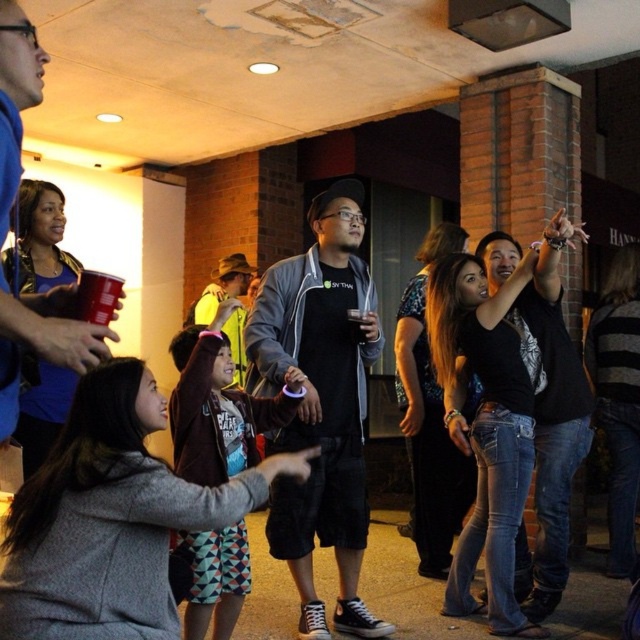
Question: Estimate the real-world distances between objects in this image. Which object is closer to the yellow fabric shirt at center?

Choices:
 (A) matte black t-shirt at center
 (B) multicolored fabric dress at center

Answer: (A)

Question: From the image, what is the correct spatial relationship of matte black t-shirt at center in relation to matte black hoodie at center?

Choices:
 (A) below
 (B) above

Answer: (A)

Question: Which of the following is the closest to the observer?

Choices:
 (A) yellow fabric shirt at center
 (B) matte black hoodie at center
 (C) matte black t-shirt at center
 (D) multicolored fabric dress at center

Answer: (B)

Question: Does matte black t-shirt at center come in front of matte black hoodie at center?

Choices:
 (A) yes
 (B) no

Answer: (B)

Question: Is matte black t-shirt at center above matte black hoodie at center?

Choices:
 (A) no
 (B) yes

Answer: (A)

Question: Which object appears farthest from the camera in this image?

Choices:
 (A) matte black t-shirt at center
 (B) multicolored fabric dress at center

Answer: (A)